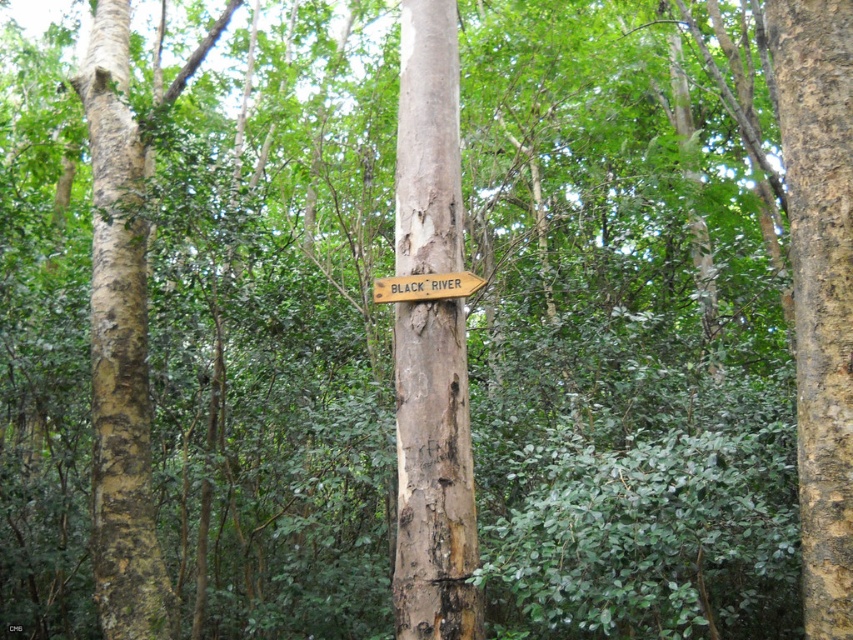
The height and width of the screenshot is (640, 853). What are the coordinates of `brown rough bark sign at center` in the screenshot? It's located at (433, 476).

Is point (397, 140) farther from camera compared to point (86, 109)?

No, it is in front of (86, 109).

Where is `brown rough bark sign at center`? brown rough bark sign at center is located at coordinates (433, 476).

Who is higher up, light brown bark tree trunk at left or wooden sign at center?

light brown bark tree trunk at left is higher up.

Measure the distance from light brown bark tree trunk at left to wooden sign at center.

They are 7.95 feet apart.

Who is more distant from viewer, (134, 372) or (376, 292)?

Point (134, 372)

You are a GUI agent. You are given a task and a screenshot of the screen. Output one action in this format:
    pyautogui.click(x=<x>, y=<y>)
    Task: Click on the light brown bark tree trunk at left
    Image resolution: width=853 pixels, height=640 pixels.
    Given the screenshot: What is the action you would take?
    pyautogui.click(x=120, y=344)

Does brown rough bark sign at center appear on the left side of wooden sign at center?

In fact, brown rough bark sign at center is to the right of wooden sign at center.

Can you confirm if brown rough bark sign at center is shorter than wooden sign at center?

In fact, brown rough bark sign at center may be taller than wooden sign at center.

Find the location of a particular element. The width and height of the screenshot is (853, 640). brown rough bark sign at center is located at coordinates (433, 476).

Where is `brown rough bark sign at center`? This screenshot has width=853, height=640. brown rough bark sign at center is located at coordinates (433, 476).